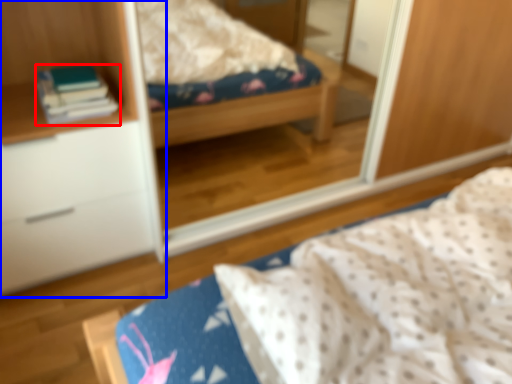
Question: Which point is further to the camera, book (highlighted by a red box) or cabinetry (highlighted by a blue box)?

Choices:
 (A) book
 (B) cabinetry

Answer: (A)